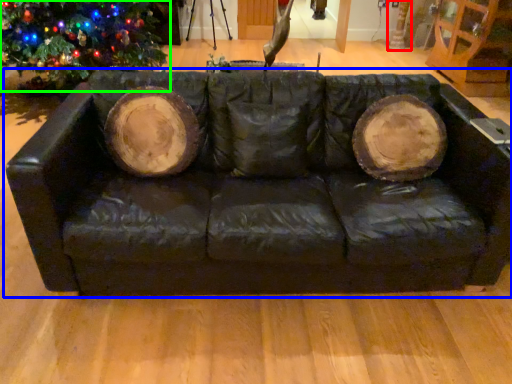
Question: Estimate the real-world distances between objects in this image. Which object is farther from tree trunk (highlighted by a red box), studio couch (highlighted by a blue box) or christmas tree (highlighted by a green box)?

Choices:
 (A) studio couch
 (B) christmas tree

Answer: (A)